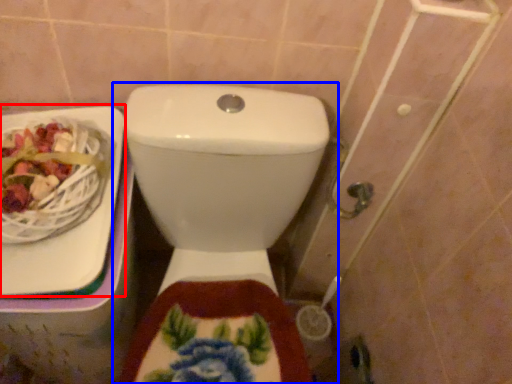
Question: Which point is closer to the camera, sink (highlighted by a red box) or toilet (highlighted by a blue box)?

Choices:
 (A) sink
 (B) toilet

Answer: (B)